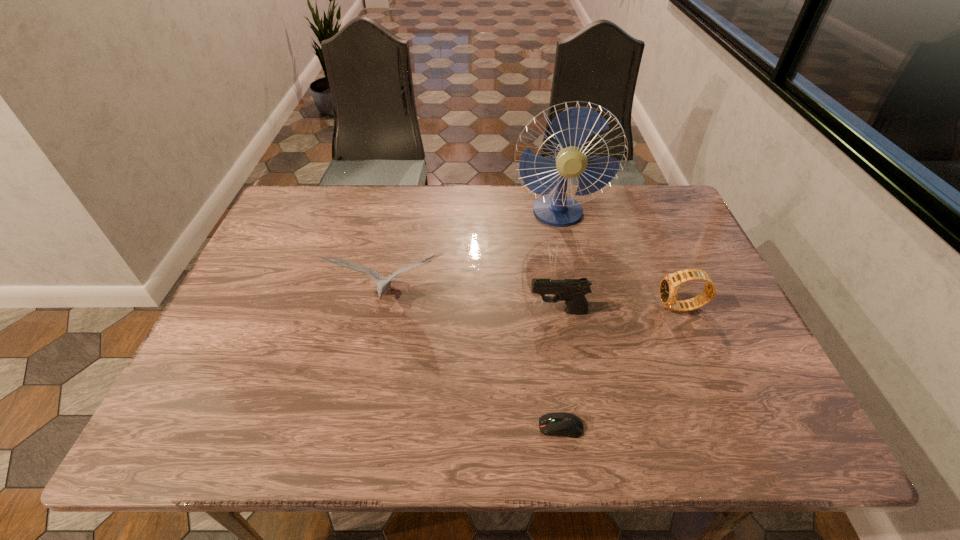
Locate an element on the screen. object that is at the near edge is located at coordinates (566, 424).

You are a GUI agent. You are given a task and a screenshot of the screen. Output one action in this format:
    pyautogui.click(x=<x>, y=<y>)
    Task: Click on the object present at the right edge
    
    Given the screenshot: What is the action you would take?
    pyautogui.click(x=669, y=285)

I want to click on free space at the far edge, so click(x=455, y=212).

Where is `vacant area at the near edge of the desktop`? This screenshot has height=540, width=960. vacant area at the near edge of the desktop is located at coordinates (603, 417).

This screenshot has height=540, width=960. I want to click on vacant space at the left edge, so click(290, 268).

This screenshot has width=960, height=540. I want to click on free space at the far left corner, so click(x=297, y=190).

In order to click on free region at the far right corner of the desktop in this screenshot , I will do `click(671, 230)`.

You are a GUI agent. You are given a task and a screenshot of the screen. Output one action in this format:
    pyautogui.click(x=<x>, y=<y>)
    Task: Click on the free space between the computer equipment and the fourth shortest object
    
    Given the screenshot: What is the action you would take?
    pyautogui.click(x=474, y=363)

Where is `blank region between the pistol and the shortest object`? The width and height of the screenshot is (960, 540). blank region between the pistol and the shortest object is located at coordinates (560, 369).

At what (x,y) coordinates should I click in order to perform the action: click on free spot between the tallest object and the rightmost object. Please return your answer as a coordinate pair (x, y). The width and height of the screenshot is (960, 540). Looking at the image, I should click on (619, 261).